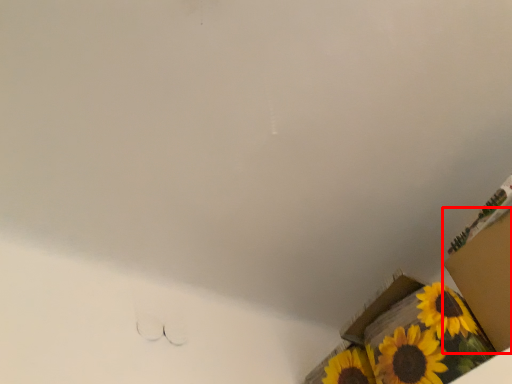
Question: Where is cardboard box (annotated by the red box) located in relation to cardboard box in the image?

Choices:
 (A) left
 (B) right

Answer: (B)